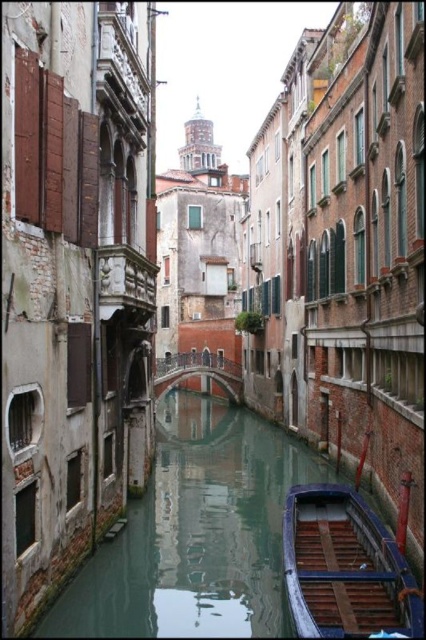
You are a tourist in Venice, and you need to navigate a wooden boat at lower center through a narrow section of the canal. The green smooth water at center marks the widest part of the canal. Can the boat pass through the narrowest part of the canal if the narrow section is as wide as the boat?

The green smooth water at center is wider than the wooden boat at lower center. Since the narrow section is as wide as the boat, the boat can pass through the narrowest part of the canal as long as it stays within the width of the boat.

You are standing on the small bridge in the canal scene. You see a point marked at coordinates (x=195, y=532). Where is this point located in relation to the green smooth water at center?

The point at (x=195, y=532) is located on the green smooth water at center.

You are standing on the bridge in the canal scene. You see the green smooth water at center and the wooden boat at lower center. Which object is closer to your feet?

The wooden boat at lower center is closer to your feet because the green smooth water at center is below it.